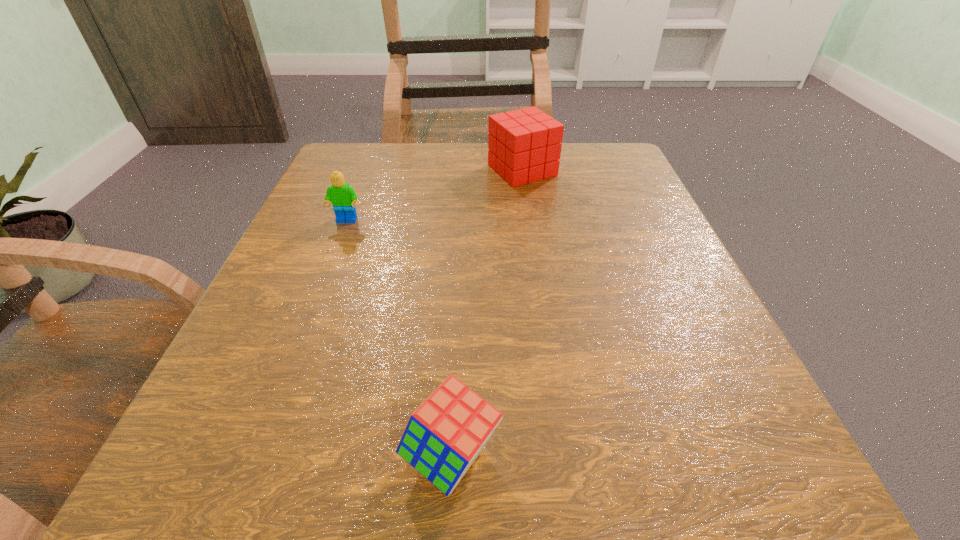
Find the location of `the farther cube`. the farther cube is located at coordinates 524,145.

Image resolution: width=960 pixels, height=540 pixels. Identify the location of the second farthest object. (342, 196).

What are the coordinates of `Lego` in the screenshot? It's located at (342, 196).

This screenshot has height=540, width=960. In order to click on the nearest object in this screenshot , I will do `click(445, 434)`.

What are the coordinates of `the shorter cube` in the screenshot? It's located at (445, 434).

You are a GUI agent. You are given a task and a screenshot of the screen. Output one action in this format:
    pyautogui.click(x=<x>, y=<y>)
    Task: Click on the free space located on the front of the farthest object
    The height and width of the screenshot is (540, 960).
    Given the screenshot: What is the action you would take?
    pyautogui.click(x=546, y=338)

This screenshot has height=540, width=960. In order to click on vacant space positioned on the face of the second farthest object in this screenshot , I will do tap(302, 334).

The width and height of the screenshot is (960, 540). Find the location of `free space located on the left of the shorter cube`. free space located on the left of the shorter cube is located at coordinates (328, 456).

Find the location of a particular element. object that is at the far edge is located at coordinates (524, 145).

The image size is (960, 540). In order to click on object at the near edge in this screenshot , I will do `click(445, 434)`.